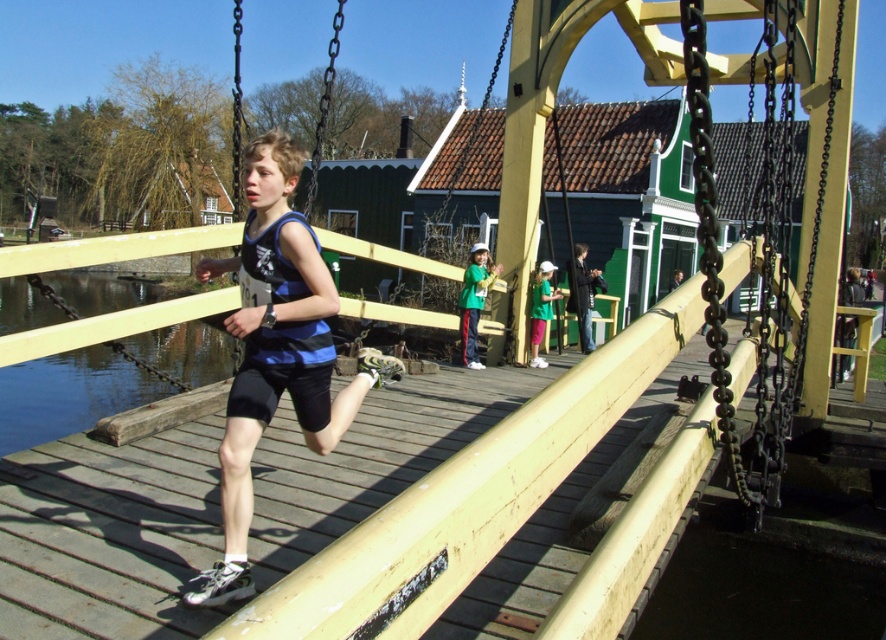
Question: Which point is closer to the camera taking this photo?

Choices:
 (A) (486, 253)
 (B) (247, 493)
 (C) (535, 269)
 (D) (585, 314)

Answer: (B)

Question: Observing the image, what is the correct spatial positioning of green matte shirt at center in reference to dark blue fabric jacket at center?

Choices:
 (A) left
 (B) right

Answer: (A)

Question: Which point appears farthest from the camera in this image?

Choices:
 (A) (549, 291)
 (B) (288, 291)
 (C) (473, 252)
 (D) (675, 273)

Answer: (D)

Question: Where is blue fabric shorts at center located in relation to blue fabric shirt at center in the image?

Choices:
 (A) left
 (B) right

Answer: (A)

Question: Based on their relative distances, which object is farther from the blue fabric shorts at center?

Choices:
 (A) blue fabric shirt at center
 (B) green fabric cap at center

Answer: (A)

Question: Is blue fabric shorts at center thinner than green matte shirt at center?

Choices:
 (A) yes
 (B) no

Answer: (B)